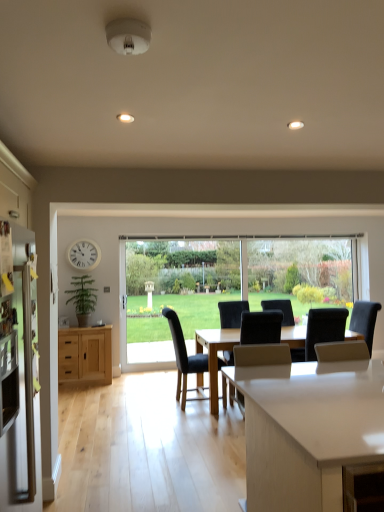
In order to face green matte plant at left, should I rotate leftwards or rightwards?

To align with it, rotate left about 14.496°.

Where is `black leather chair at center, which ranks as the third chair in right-to-left order`? This screenshot has height=512, width=384. black leather chair at center, which ranks as the third chair in right-to-left order is located at coordinates (184, 355).

What do you see at coordinates (19, 391) in the screenshot? This screenshot has height=512, width=384. I see `satin stainless steel refrigerator at left` at bounding box center [19, 391].

Describe the element at coordinates (261, 355) in the screenshot. This screenshot has width=384, height=512. I see `dark blue fabric chair at center, the 2th chair from the left` at that location.

This screenshot has width=384, height=512. In order to click on dark blue fabric chair at center, the 2th chair from the left in this screenshot , I will do `click(261, 355)`.

I want to click on green matte plant at left, so point(82,298).

From a real-world perspective, is dark blue fabric chair at center, acting as the 2th chair starting from the right, positioned over white plastic clock at upper left based on gravity?

No, from a real-world perspective, dark blue fabric chair at center, acting as the 2th chair starting from the right, is not above white plastic clock at upper left.

This screenshot has height=512, width=384. In order to click on the 2nd chair below the white plastic clock at upper left (from the image's perspective) in this screenshot , I will do `click(261, 355)`.

Considering the relative sizes of dark blue fabric chair at center, acting as the 2th chair starting from the right, and white plastic clock at upper left in the image provided, is dark blue fabric chair at center, acting as the 2th chair starting from the right, shorter than white plastic clock at upper left?

Incorrect, the height of dark blue fabric chair at center, acting as the 2th chair starting from the right, does not fall short of that of white plastic clock at upper left.

Can you tell me how much dark blue fabric chair at center, the 2th chair from the left, and white plastic clock at upper left differ in facing direction?

The angular difference between dark blue fabric chair at center, the 2th chair from the left, and white plastic clock at upper left is 179 degrees.

Is point (38, 502) positioned in front of point (93, 295)?

Yes, it is.

Is satin stainless steel refrigerator at left facing away from green matte plant at left?

satin stainless steel refrigerator at left does not have its back to green matte plant at left.

Based on their sizes in the image, would you say satin stainless steel refrigerator at left is bigger or smaller than green matte plant at left?

In the image, satin stainless steel refrigerator at left appears to be larger than green matte plant at left.

Is satin stainless steel refrigerator at left positioned before green matte plant at left?

Yes.

Are black fabric chair at center, which ranks as the third chair in left-to-right order, and natural wood cabinet at left far apart?

That's right, there is a large distance between black fabric chair at center, which ranks as the third chair in left-to-right order, and natural wood cabinet at left.

From the image's perspective, is black fabric chair at center, which ranks as the third chair in left-to-right order, on top of natural wood cabinet at left?

Yes, from the image's perspective, black fabric chair at center, which ranks as the third chair in left-to-right order, is above natural wood cabinet at left.

In terms of width, does black fabric chair at center, which ranks as the third chair in left-to-right order, look wider or thinner when compared to natural wood cabinet at left?

In the image, black fabric chair at center, which ranks as the third chair in left-to-right order, appears to be wider than natural wood cabinet at left.

Does black fabric chair at center, which ranks as the third chair in left-to-right order, have a lesser height compared to natural wood cabinet at left?

Correct, black fabric chair at center, which ranks as the third chair in left-to-right order, is not as tall as natural wood cabinet at left.

Consider the image. Between satin stainless steel refrigerator at left and natural wood cabinet at left, which one has less height?

natural wood cabinet at left.

Is satin stainless steel refrigerator at left far from natural wood cabinet at left?

satin stainless steel refrigerator at left is far away from natural wood cabinet at left.

In the image, is satin stainless steel refrigerator at left on the left side or the right side of natural wood cabinet at left?

From the image, it's evident that satin stainless steel refrigerator at left is to the right of natural wood cabinet at left.

Is satin stainless steel refrigerator at left thinner than natural wood cabinet at left?

Yes, satin stainless steel refrigerator at left is thinner than natural wood cabinet at left.

Is satin stainless steel refrigerator at left not inside white plastic clock at upper left?

satin stainless steel refrigerator at left is positioned outside white plastic clock at upper left.

From a real-world perspective, is satin stainless steel refrigerator at left physically located above or below white plastic clock at upper left?

Clearly, from a real-world perspective, satin stainless steel refrigerator at left is below white plastic clock at upper left.

Who is more distant, satin stainless steel refrigerator at left or white plastic clock at upper left?

Positioned behind is white plastic clock at upper left.

From the picture: Can you confirm if satin stainless steel refrigerator at left is smaller than white plastic clock at upper left?

Incorrect, satin stainless steel refrigerator at left is not smaller in size than white plastic clock at upper left.

In the scene shown: Between natural wood cabinet at left and black fabric chair at center, which ranks as the third chair in left-to-right order, which one has more height?

With more height is natural wood cabinet at left.

Based on the photo, can you confirm if natural wood cabinet at left is smaller than black fabric chair at center, placed as the first chair when sorted from right to left?

Incorrect, natural wood cabinet at left is not smaller in size than black fabric chair at center, placed as the first chair when sorted from right to left.

Which object is positioned more to the left, natural wood cabinet at left or black fabric chair at center, which ranks as the third chair in left-to-right order?

natural wood cabinet at left.

I want to click on cabinetry behind the black fabric chair at center, placed as the first chair when sorted from right to left, so click(85, 354).

Does white glossy countertop at center have a smaller size compared to green matte plant at left?

Actually, white glossy countertop at center might be larger than green matte plant at left.

Is white glossy countertop at center not inside green matte plant at left?

Indeed, white glossy countertop at center is completely outside green matte plant at left.

This screenshot has width=384, height=512. Find the location of `clock located on the left of dark blue fabric chair at center, acting as the 2th chair starting from the right`. clock located on the left of dark blue fabric chair at center, acting as the 2th chair starting from the right is located at coordinates (84, 255).

Locate an element on the screen. The image size is (384, 512). houseplant located above the satin stainless steel refrigerator at left (from the image's perspective) is located at coordinates [82, 298].

Based on their spatial positions, is white plastic clock at upper left or black leather chair at center, placed as the 1th chair when sorted from left to right, further from green matte plant at left?

Based on the image, black leather chair at center, placed as the 1th chair when sorted from left to right, appears to be further to green matte plant at left.

Which object lies further to the anchor point white plastic clock at upper left, dark blue fabric chair at center, the 2th chair from the left, or natural wood cabinet at left?

dark blue fabric chair at center, the 2th chair from the left.

Looking at the image, which one is located further to white plastic clock at upper left, natural wood cabinet at left or black fabric chair at center, placed as the first chair when sorted from right to left?

Based on the image, black fabric chair at center, placed as the first chair when sorted from right to left, appears to be further to white plastic clock at upper left.

Looking at the image, which one is located further to black leather chair at center, which ranks as the third chair in right-to-left order, natural wood cabinet at left or white glossy countertop at center?

white glossy countertop at center is further to black leather chair at center, which ranks as the third chair in right-to-left order.

Looking at the image, which one is located further to black leather chair at center, placed as the 1th chair when sorted from left to right, natural wood cabinet at left or black fabric chair at center, placed as the first chair when sorted from right to left?

natural wood cabinet at left is further to black leather chair at center, placed as the 1th chair when sorted from left to right.

Estimate the real-world distances between objects in this image. Which object is closer to satin stainless steel refrigerator at left, black fabric chair at center, which ranks as the third chair in left-to-right order, or black leather chair at center, which ranks as the third chair in right-to-left order?

black leather chair at center, which ranks as the third chair in right-to-left order, is positioned closer to the anchor satin stainless steel refrigerator at left.

From the image, which object appears to be farther from satin stainless steel refrigerator at left, black leather chair at center, placed as the 1th chair when sorted from left to right, or green matte plant at left?

green matte plant at left is further to satin stainless steel refrigerator at left.

Which object lies nearer to the anchor point satin stainless steel refrigerator at left, black fabric chair at center, which ranks as the third chair in left-to-right order, or natural wood cabinet at left?

black fabric chair at center, which ranks as the third chair in left-to-right order, is positioned closer to the anchor satin stainless steel refrigerator at left.

The height and width of the screenshot is (512, 384). I want to click on refrigerator between white glossy countertop at center and green matte plant at left in the front-back direction, so click(19, 391).

This screenshot has width=384, height=512. I want to click on chair between black leather chair at center, which ranks as the third chair in right-to-left order, and black fabric chair at center, which ranks as the third chair in left-to-right order, in the horizontal direction, so click(261, 355).

The width and height of the screenshot is (384, 512). Identify the location of cabinetry between green matte plant at left and black leather chair at center, placed as the 1th chair when sorted from left to right. (85, 354).

In order to click on houseplant between white plastic clock at upper left and black leather chair at center, which ranks as the third chair in right-to-left order in this screenshot , I will do `click(82, 298)`.